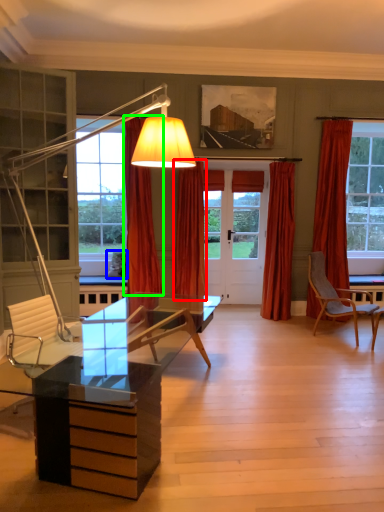
Question: Based on their relative distances, which object is farther from curtain (highlighted by a red box)? Choose from pillow (highlighted by a blue box) and curtain (highlighted by a green box).

Choices:
 (A) pillow
 (B) curtain

Answer: (A)